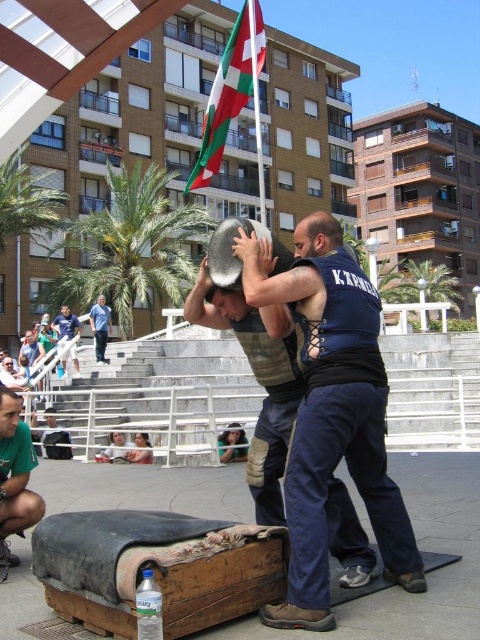
You are standing at the scene and want to take a photo of the green fabric man at lower left. Considering the distance, would you need to use a zoom lens to capture the entire figure in the frame?

The green fabric man at lower left is 12.64 meters from viewer, so you would need a zoom lens to capture the entire figure in the frame from that distance.

You are a photographer trying to capture a photo of the dark blue uniform at center and the green and white fabric flag at upper center. To ensure both subjects are in frame, which object should you position closer to the camera?

The photographer should position the green and white fabric flag at upper center closer to the camera because the dark blue uniform at center is to the right of it, so moving the flag forward will keep both in frame.

You are a photographer trying to capture the scene. You want to ensure that both the green fabric man at lower left and the blue cotton shirt at lower left are clearly visible in your photo. Given their positions, which one should you focus on first to ensure proper focus?

The green fabric man at lower left is positioned under the blue cotton shirt at lower left. To ensure both are in focus, you should focus on the green fabric man at lower left first since it is closer to the camera, and the blue cotton shirt at lower left will naturally fall into focus as it is behind.